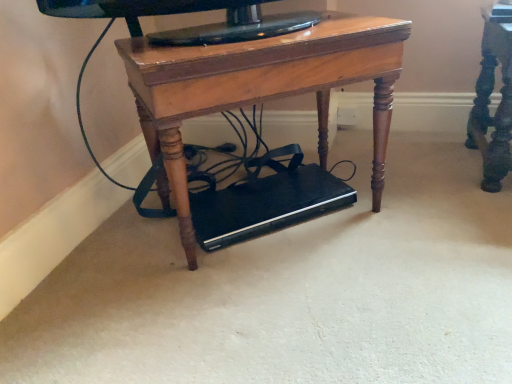
This screenshot has width=512, height=384. What are the coordinates of `wooden table at center` in the screenshot? It's located at (254, 103).

The width and height of the screenshot is (512, 384). What do you see at coordinates (254, 103) in the screenshot? I see `wooden table at center` at bounding box center [254, 103].

What is the approximate width of wooden table at center?

The width of wooden table at center is 15.40 inches.

Where is `wooden table at center`? This screenshot has width=512, height=384. wooden table at center is located at coordinates (254, 103).